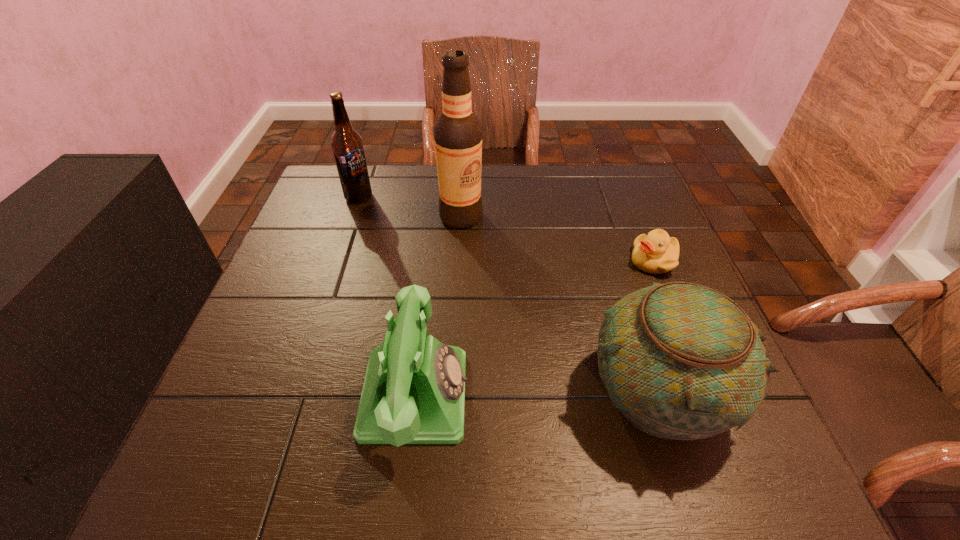
This screenshot has height=540, width=960. In order to click on vacant region located 0.270m on the front-facing side of the duckling in this screenshot , I will do pyautogui.click(x=582, y=346).

This screenshot has width=960, height=540. I want to click on vacant space located 0.090m on the front-facing side of the duckling, so click(x=625, y=296).

The width and height of the screenshot is (960, 540). What are the coordinates of `free space located on the label of the alcohol` in the screenshot? It's located at (489, 280).

I want to click on free region located 0.160m on the label of the alcohol, so click(485, 271).

Locate an element on the screen. This screenshot has height=540, width=960. vacant space situated on the label of the alcohol is located at coordinates 519,349.

Identify the location of vacant area situated on the label of the leftmost object. (396, 244).

This screenshot has height=540, width=960. Identify the location of free spot located 0.290m on the label of the leftmost object. (412, 265).

I want to click on vacant space located on the label of the leftmost object, so tap(389, 235).

Where is `alcohol located at the far edge`? The height and width of the screenshot is (540, 960). alcohol located at the far edge is located at coordinates (457, 132).

What are the coordinates of `beer bottle located at the far edge` in the screenshot? It's located at (346, 143).